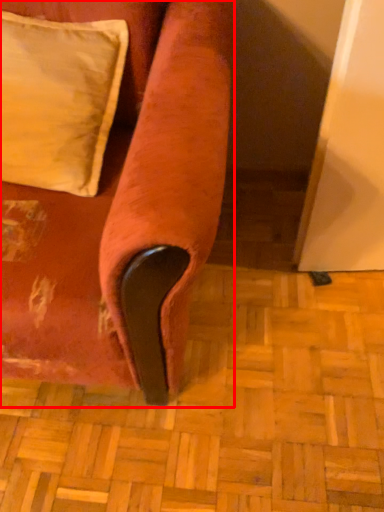
Question: From the image's perspective, where is furniture (annotated by the red box) located in relation to pillow in the image?

Choices:
 (A) below
 (B) above

Answer: (A)